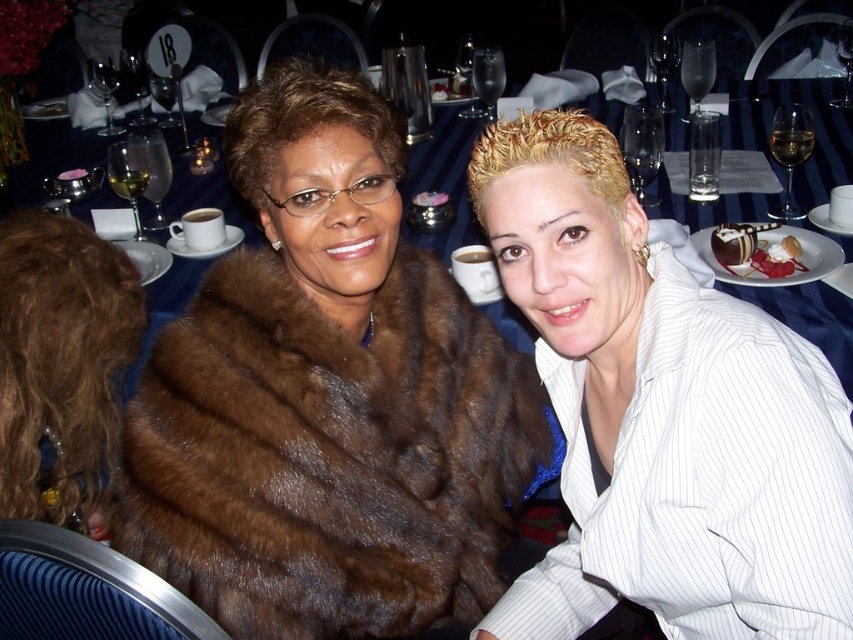
Question: Does chocolate glazed cake at right have a greater width compared to chocolate cake at center?

Choices:
 (A) no
 (B) yes

Answer: (B)

Question: Among these points, which one is farthest from the camera?

Choices:
 (A) (463, 90)
 (B) (480, 236)
 (C) (329, 388)
 (D) (497, 152)

Answer: (A)

Question: Which point is closer to the camera?

Choices:
 (A) (425, 156)
 (B) (669, 442)
 (C) (460, 77)

Answer: (B)

Question: Is blue fabric table at center above chocolate glazed cake at right?

Choices:
 (A) no
 (B) yes

Answer: (B)

Question: Which point appears closest to the camera in this image?

Choices:
 (A) (465, 92)
 (B) (175, 260)
 (C) (720, 241)
 (D) (737, 525)

Answer: (D)

Question: Where is white striped shirt at center located in relation to blue fabric table at center in the image?

Choices:
 (A) below
 (B) above

Answer: (A)